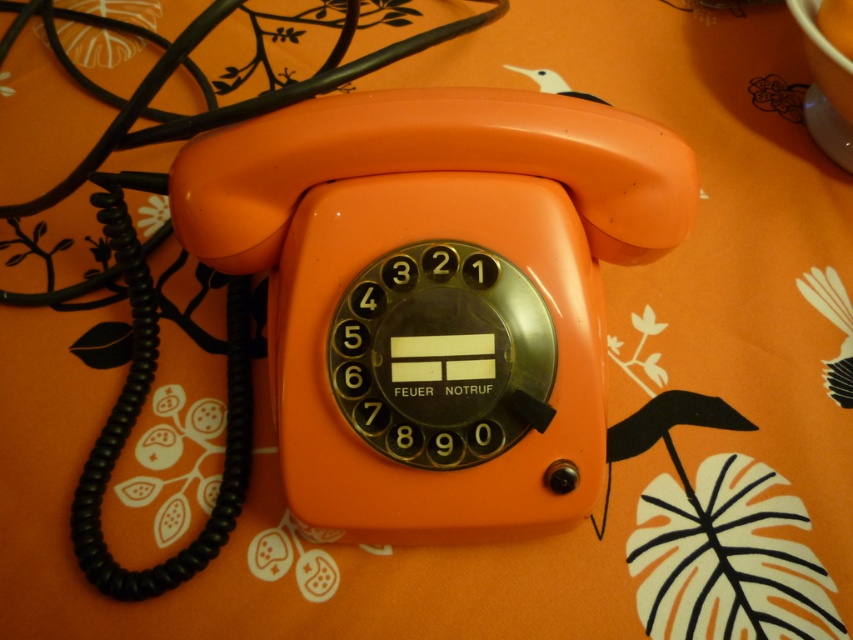
You are setting up a small table for a retro themed party and have placed an orange matte phone at center and a matte plastic cup at upper center. You want to arrange a napkin between them. Where should you place the napkin so it is between the two items?

The napkin should be placed between the orange matte phone at center and the matte plastic cup at upper center, since the orange matte phone at center is to the left of the matte plastic cup at upper center.

You are a delivery person who needs to place a small package on the table. The package is 30 inches long. There is an orange matte phone at center and a matte plastic cup at upper center on the table. Can you fit the package between them without moving either object?

The distance between the orange matte phone at center and the matte plastic cup at upper center is 28.45 inches. Since the package is 30 inches long, it cannot fit between them without moving either object.